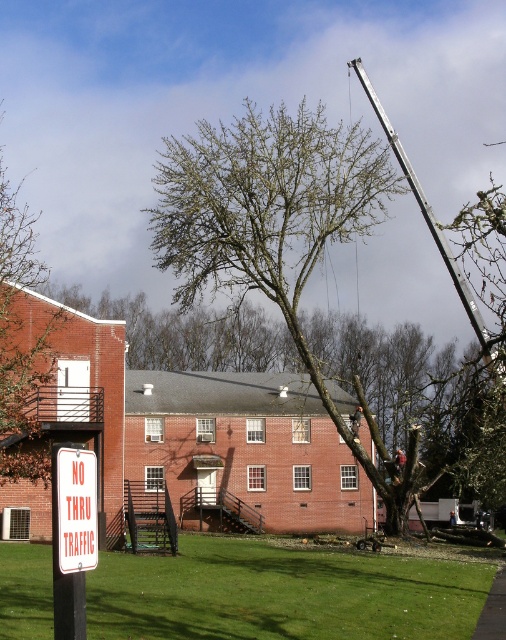
You are a delivery driver who needs to park your truck near the NO THRU TRAFFIC sign. The truck requires a clear space of 10 meters in length. Based on the scene, can you determine if the green grass at lower center and the brown leafy tree at upper left allow enough space for parking?

The green grass at lower center is in front of the brown leafy tree at upper left, which means there is open space available. However, the scene does not provide specific measurements about the distance between these objects. Without knowing the exact distance between the green grass at lower center and any other obstacles, it is impossible to confirm if there is a 10 meter clear space available for parking the truck.

You are a gardener who needs to mow the lawn. You see the green grass at lower center and the white plastic sign at lower left. Which object is taller and requires more attention for trimming?

The green grass at lower center is taller than the white plastic sign at lower left, so it requires more attention for trimming.

You are a delivery driver who needs to navigate through this area. You see the brown leafy tree at upper left and the white plastic sign at lower left. Which object is bigger in size?

The brown leafy tree at upper left is larger in size compared to the white plastic sign at lower left.